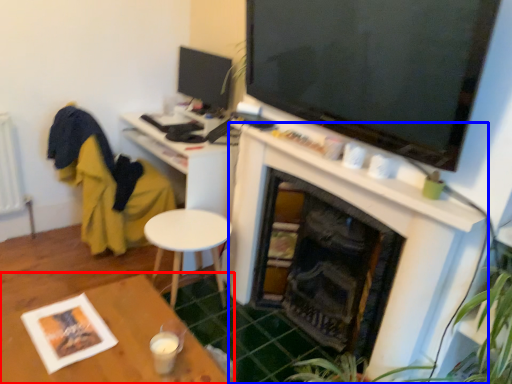
Question: Which point is further to the camera, table (highlighted by a red box) or fireplace (highlighted by a blue box)?

Choices:
 (A) table
 (B) fireplace

Answer: (B)